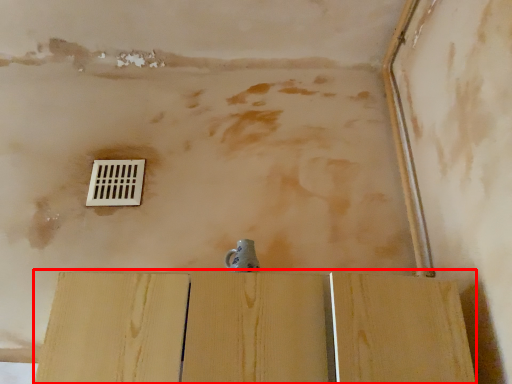
Question: From the image's perspective, where is plywood (annotated by the red box) located in relation to window in the image?

Choices:
 (A) below
 (B) above

Answer: (A)